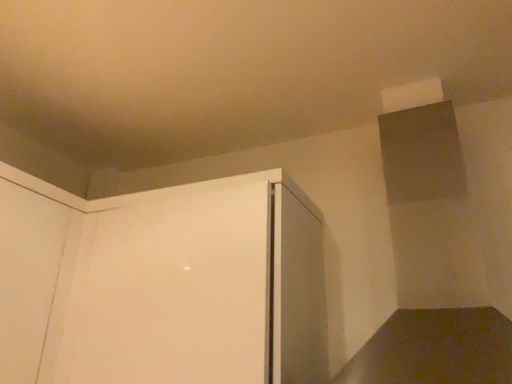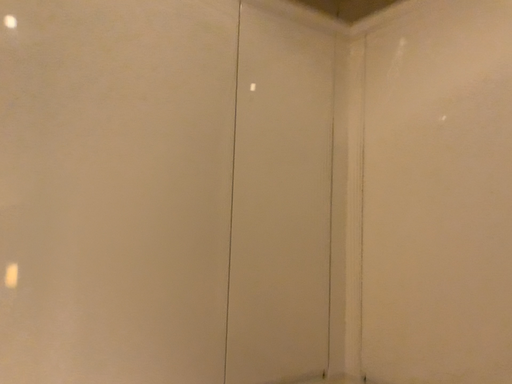
Question: How did the camera likely rotate when shooting the video?

Choices:
 (A) rotated right
 (B) rotated left

Answer: (B)